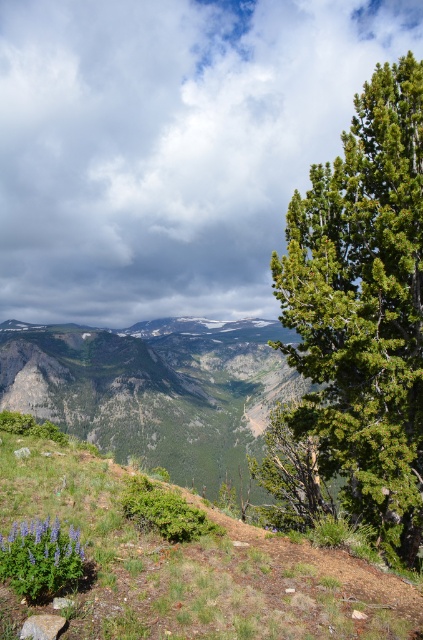
Question: Does green textured tree at right appear over purple matte flower at lower left?

Choices:
 (A) yes
 (B) no

Answer: (A)

Question: Considering the relative positions of green grassy at lower left and purple matte flower at lower left in the image provided, where is green grassy at lower left located with respect to purple matte flower at lower left?

Choices:
 (A) right
 (B) left

Answer: (A)

Question: Is green grassy hillside at center positioned before purple matte flower at lower left?

Choices:
 (A) yes
 (B) no

Answer: (B)

Question: Estimate the real-world distances between objects in this image. Which object is farther from the green grassy at lower left?

Choices:
 (A) green grassy hillside at center
 (B) green textured tree at right

Answer: (A)

Question: Based on their relative distances, which object is farther from the purple matte flower at lower left?

Choices:
 (A) green grassy at lower left
 (B) green textured tree at right
 (C) green grassy hillside at center

Answer: (C)

Question: Which is nearer to the green grassy at lower left?

Choices:
 (A) green textured tree at right
 (B) purple matte flower at lower left

Answer: (B)